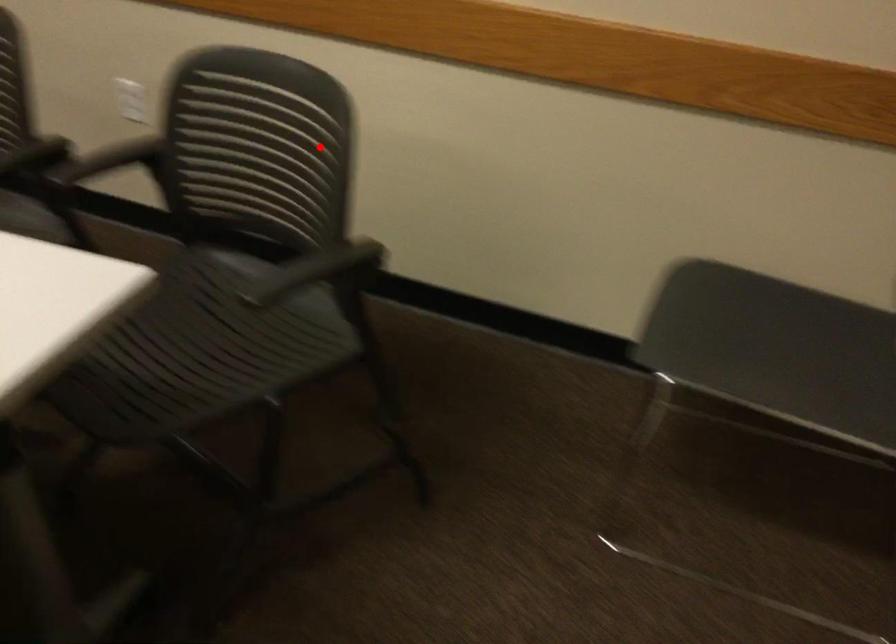
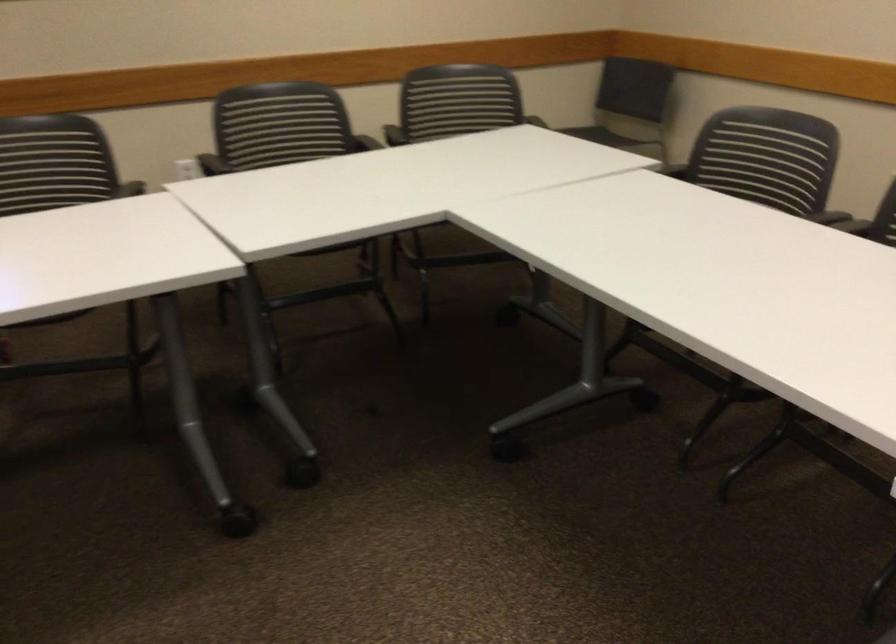
Question: A red point is marked in image1. In image2, is the corresponding 3D point closer to the camera or farther? Reply with the corresponding letter.

Choices:
 (A) The corresponding 3D point is closer.
 (B) The corresponding 3D point is farther.

Answer: (B)